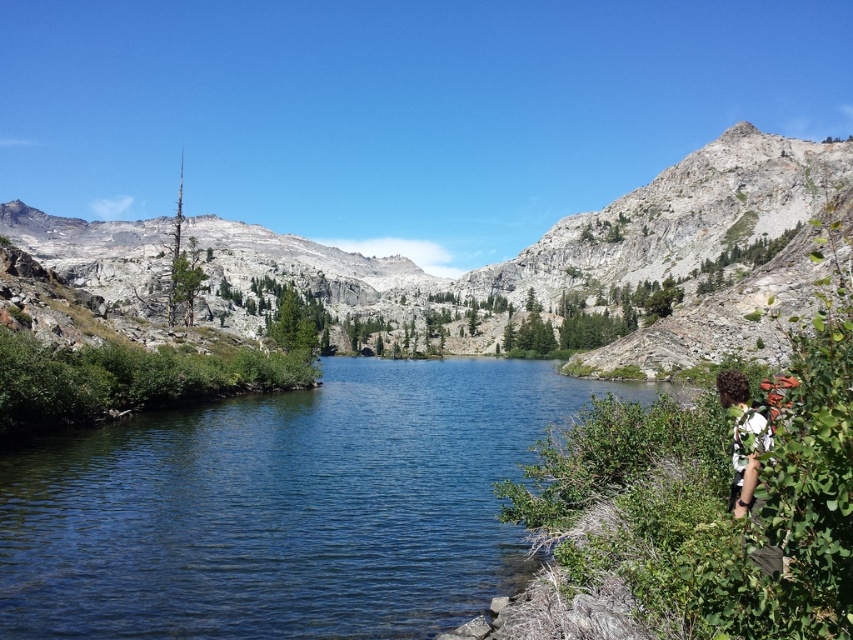
Between gray rocky mountain at center and curly hair at lower right, which one appears on the left side from the viewer's perspective?

gray rocky mountain at center is more to the left.

Is gray rocky mountain at center further to the viewer compared to curly hair at lower right?

Yes, gray rocky mountain at center is further from the viewer.

Is point (846, 154) positioned in front of point (741, 401)?

No, (846, 154) is further to viewer.

At what (x,y) coordinates should I click in order to perform the action: click on gray rocky mountain at center. Please return your answer as a coordinate pair (x, y). The height and width of the screenshot is (640, 853). Looking at the image, I should click on (563, 234).

Which is more to the right, clear water at center or curly hair at lower right?

curly hair at lower right

Where is `clear water at center`? clear water at center is located at coordinates (285, 508).

Is point (459, 483) positioned before point (746, 397)?

No, it is behind (746, 397).

Where is `clear water at center`? clear water at center is located at coordinates [285, 508].

Is clear water at center positioned in front of gray rocky mountain at center?

Yes, it is in front of gray rocky mountain at center.

Does clear water at center have a greater width compared to gray rocky mountain at center?

Incorrect, clear water at center's width does not surpass gray rocky mountain at center's.

Is point (283, 548) farther from camera compared to point (740, 292)?

No, it is in front of (740, 292).

Find the location of a particular element. This screenshot has width=853, height=640. clear water at center is located at coordinates (285, 508).